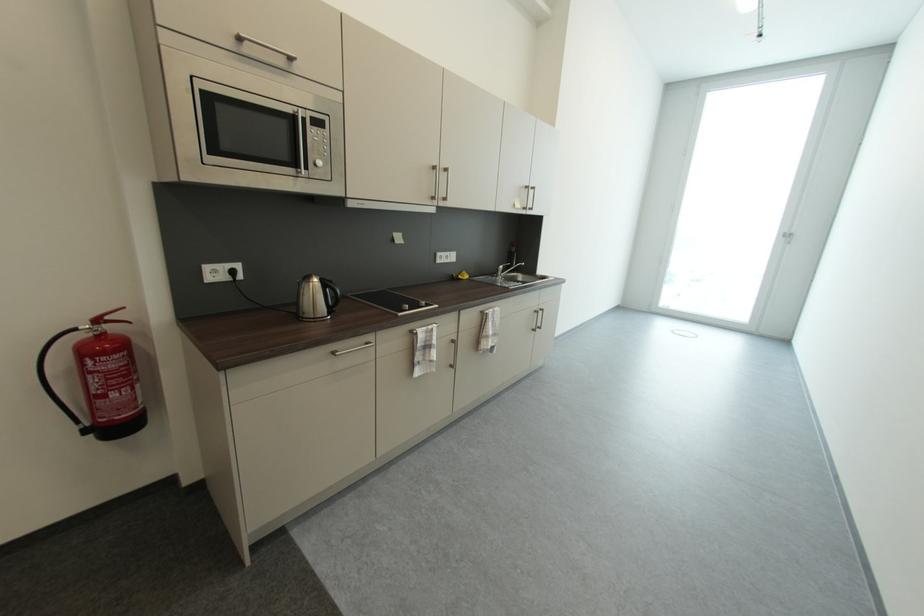
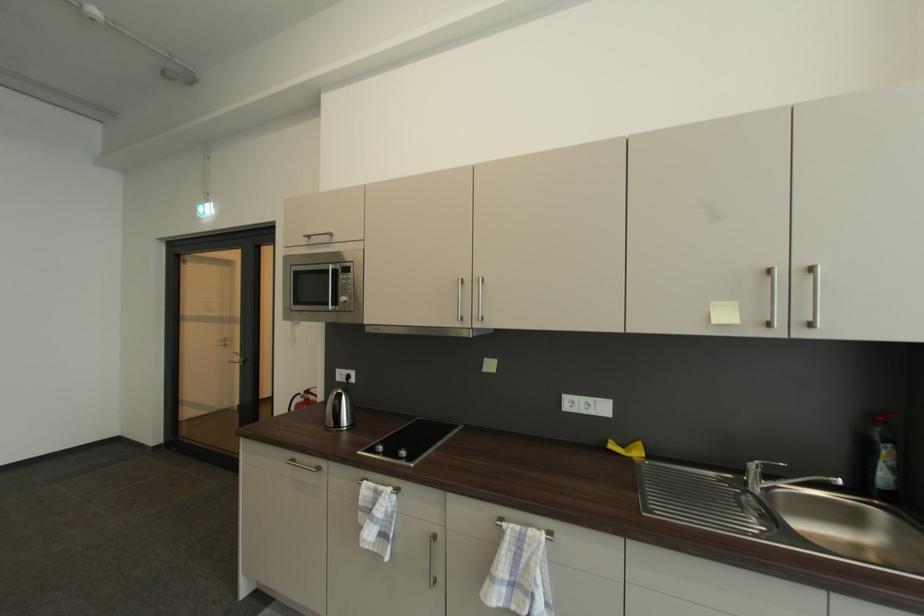
Where in the second image is the point corresponding to pixel 343 357 from the first image?

(295, 464)